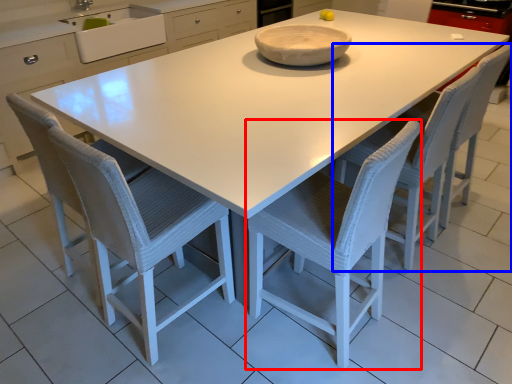
Question: Among these objects, which one is nearest to the camera, chair (highlighted by a red box) or chair (highlighted by a blue box)?

Choices:
 (A) chair
 (B) chair

Answer: (A)